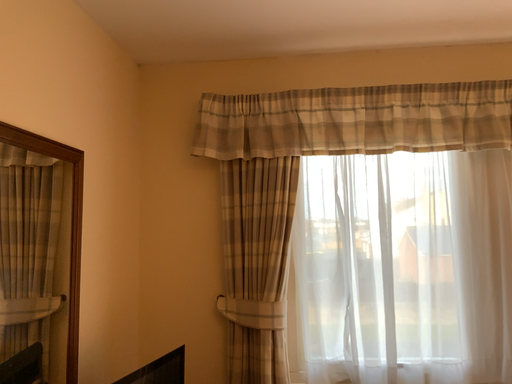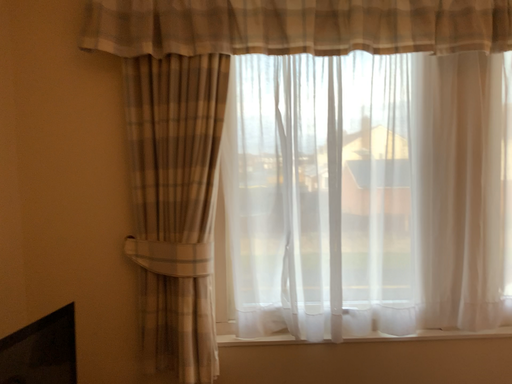
Question: How did the camera likely rotate when shooting the video?

Choices:
 (A) rotated downward
 (B) rotated upward

Answer: (A)